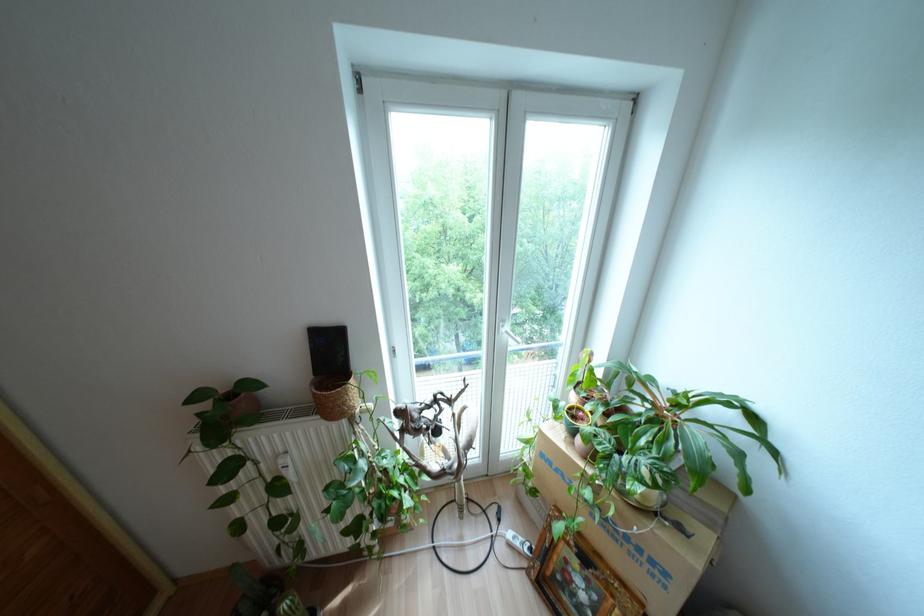
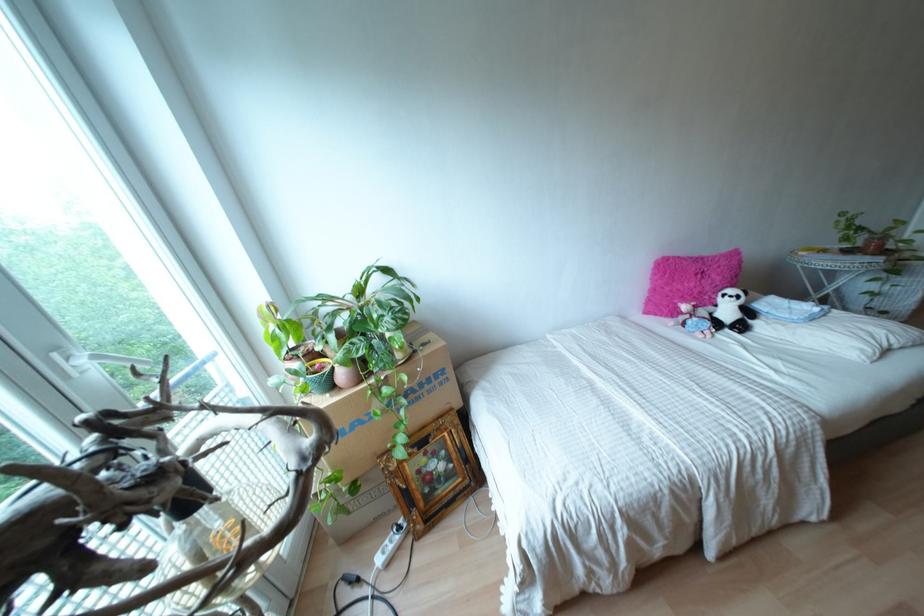
The images are taken continuously from a first-person perspective. In which direction is your viewpoint rotating?

The camera rotated toward right-down.